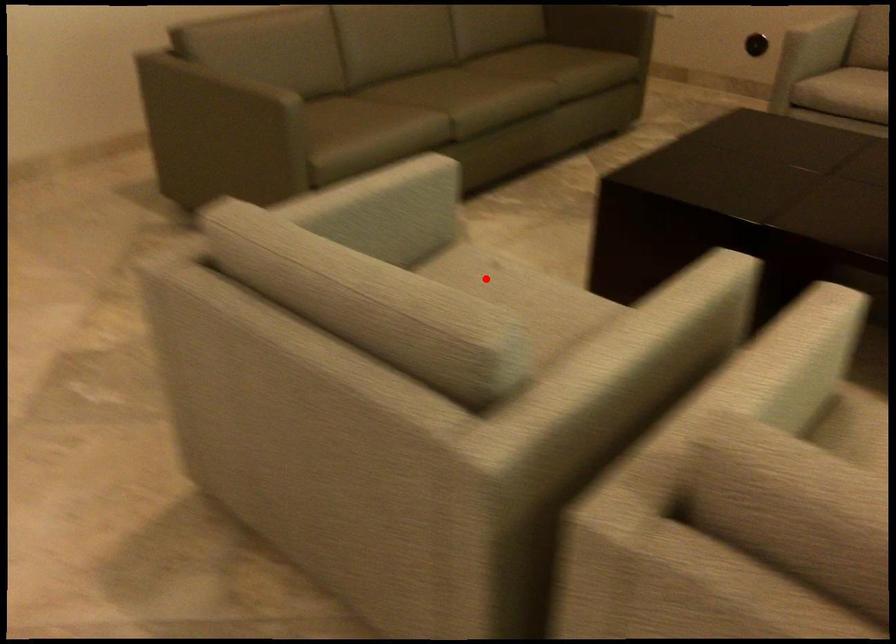
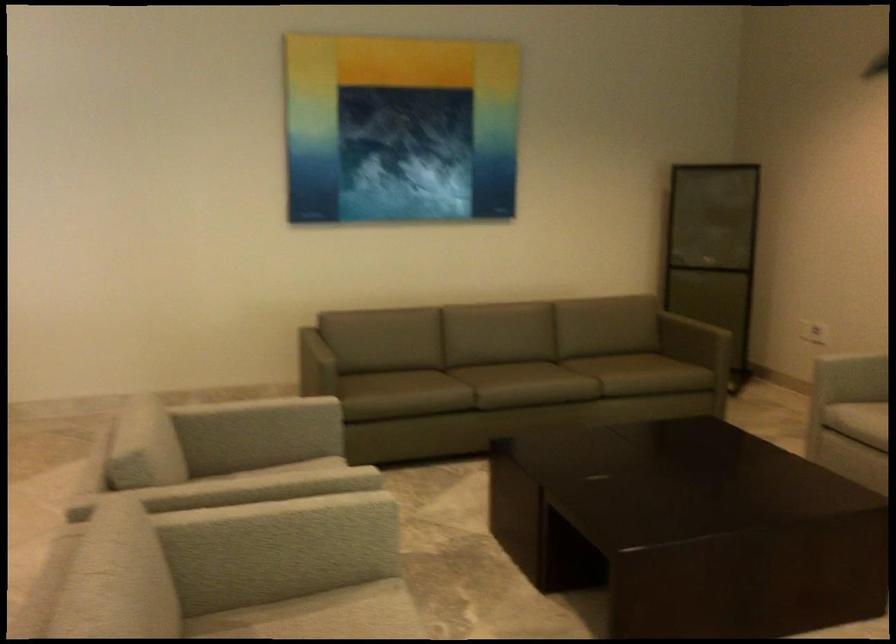
Question: I am providing you with two images of the same scene from different viewpoints. A red point is marked on the first image. At the location where the point appears in image 1, is it still visible in image 2?

Choices:
 (A) Yes
 (B) No

Answer: (B)